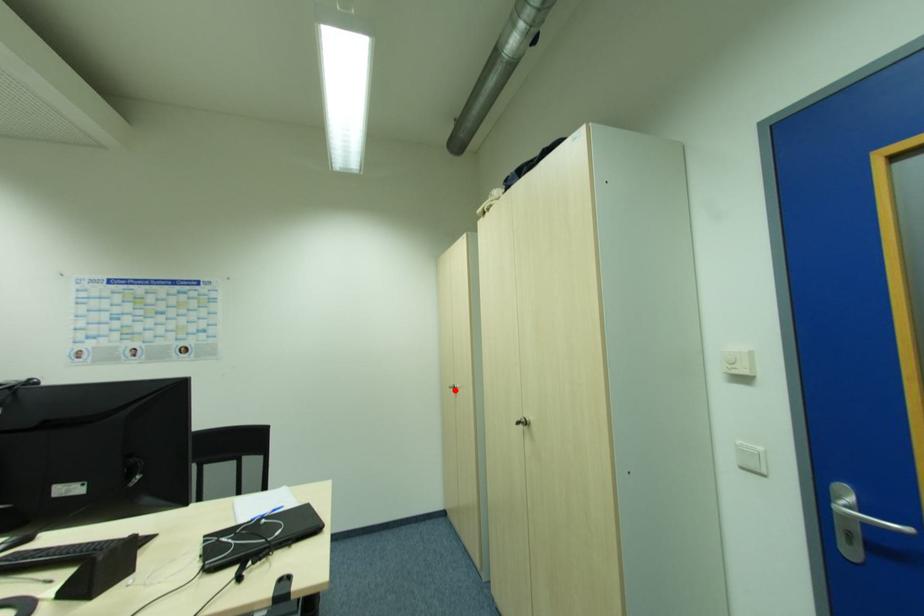
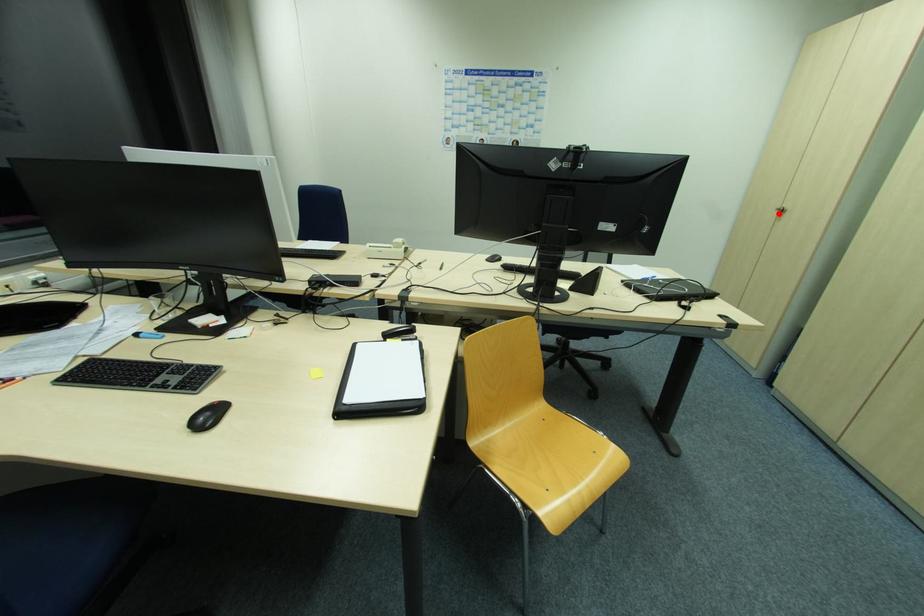
I am providing you with two images of the same scene from different viewpoints. A red point is marked on the first image and another point is marked on the second image. Is the marked point in image1 the same physical position as the marked point in image2?

Yes